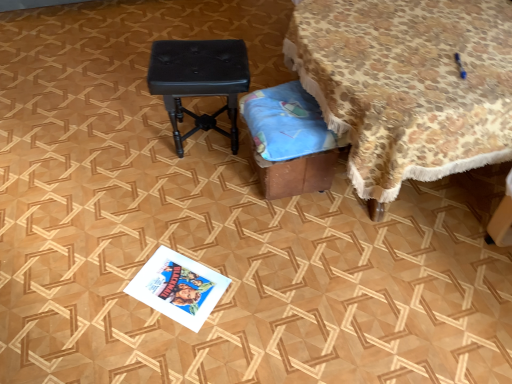
Locate an element on the screen. The height and width of the screenshot is (384, 512). free point behind white glossy magazine at lower center is located at coordinates (x=187, y=231).